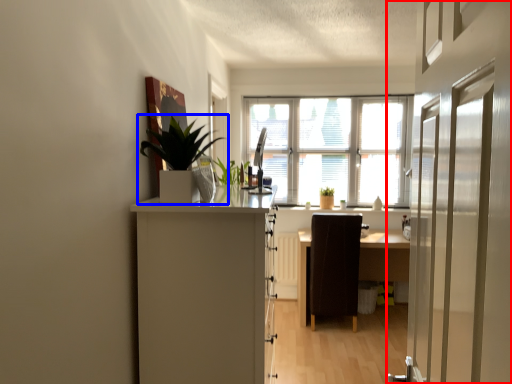
Question: Among these objects, which one is farthest to the camera, door (highlighted by a red box) or houseplant (highlighted by a blue box)?

Choices:
 (A) door
 (B) houseplant

Answer: (B)